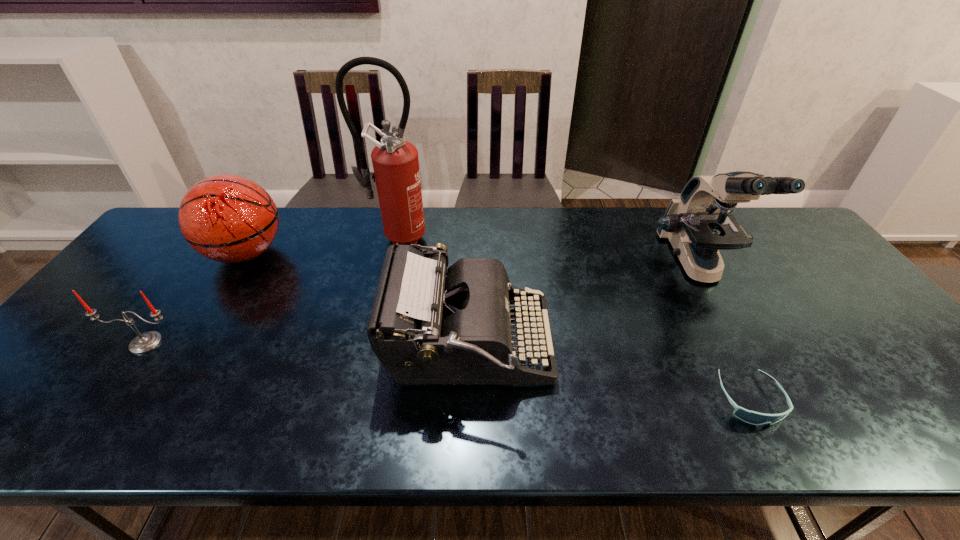
In the image, there is a desktop. Identify the location of vacant space at the right edge. The width and height of the screenshot is (960, 540). (937, 400).

The width and height of the screenshot is (960, 540). In the image, there is a desktop. In order to click on vacant space at the near right corner in this screenshot , I will do coord(945,421).

The height and width of the screenshot is (540, 960). In order to click on vacant point located between the fourth shortest object and the typewriter in this screenshot , I will do `click(357, 300)`.

This screenshot has width=960, height=540. Identify the location of unoccupied area between the goggles and the fire extinguisher. (573, 318).

This screenshot has width=960, height=540. I want to click on vacant region between the shortest object and the second tallest object, so click(724, 333).

This screenshot has width=960, height=540. What are the coordinates of `empty space between the fire extinguisher and the candle` in the screenshot? It's located at (272, 289).

Locate an element on the screen. This screenshot has height=540, width=960. vacant area that lies between the candle and the basketball is located at coordinates (196, 298).

Identify the location of vacant area that lies between the tallest object and the microscope. The image size is (960, 540). (547, 252).

At what (x,y) coordinates should I click in order to perform the action: click on free space between the shortest object and the tallest object. Please return your answer as a coordinate pair (x, y). Image resolution: width=960 pixels, height=540 pixels. Looking at the image, I should click on (573, 318).

Find the location of a particular element. The height and width of the screenshot is (540, 960). vacant space in between the typewriter and the candle is located at coordinates (307, 344).